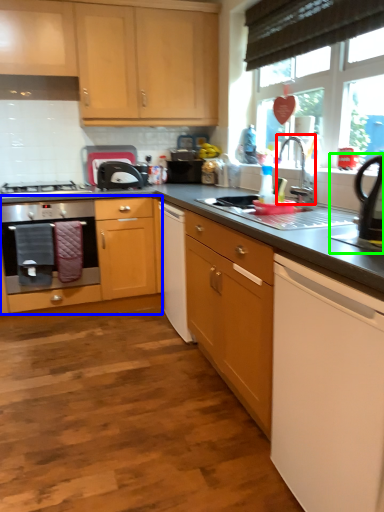
Question: Which object is the farthest from tap (highlighted by a red box)? Choose among these: cabinetry (highlighted by a blue box) or appliance (highlighted by a green box).

Choices:
 (A) cabinetry
 (B) appliance

Answer: (A)